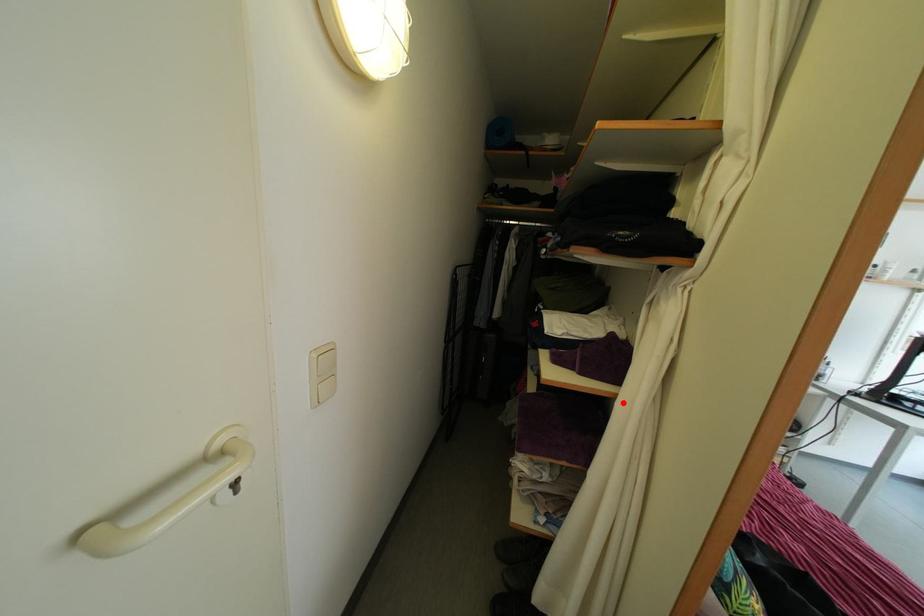
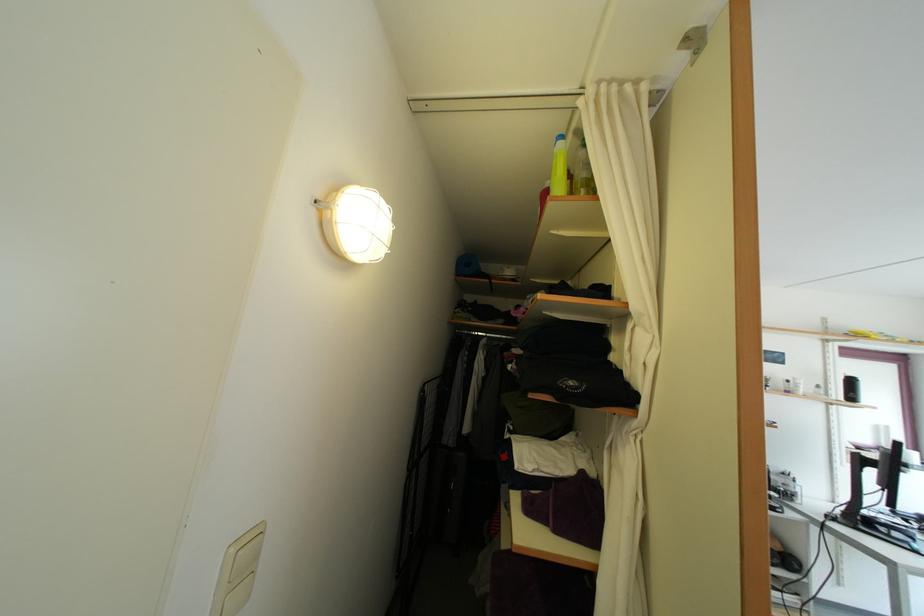
In the second image, find the point that corresponds to the highlighted location in the first image.

(602, 576)